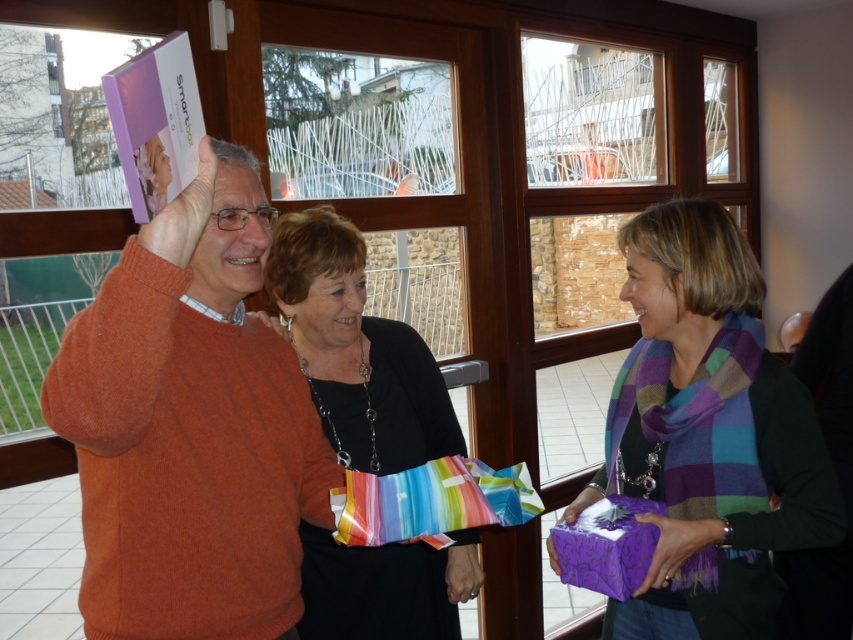
Question: Can you confirm if orange sweater at upper left is wider than purple glossy gift at lower right?

Choices:
 (A) yes
 (B) no

Answer: (A)

Question: Is orange sweater at left below black fabric purse at center?

Choices:
 (A) yes
 (B) no

Answer: (B)

Question: Can you confirm if orange sweater at upper left is bigger than black fabric purse at center?

Choices:
 (A) yes
 (B) no

Answer: (B)

Question: Which point appears closest to the camera in this image?

Choices:
 (A) (167, 496)
 (B) (442, 429)
 (C) (645, 518)
 (D) (105, 355)

Answer: (D)

Question: Which object is the farthest from the rainbow striped paper bag at center?

Choices:
 (A) purple glossy gift at lower right
 (B) orange sweater at left
 (C) purple matte gift at center
 (D) orange sweater at upper left

Answer: (C)

Question: Which object is closer to the camera taking this photo?

Choices:
 (A) purple matte gift at center
 (B) rainbow striped paper bag at center
 (C) black fabric purse at center

Answer: (B)